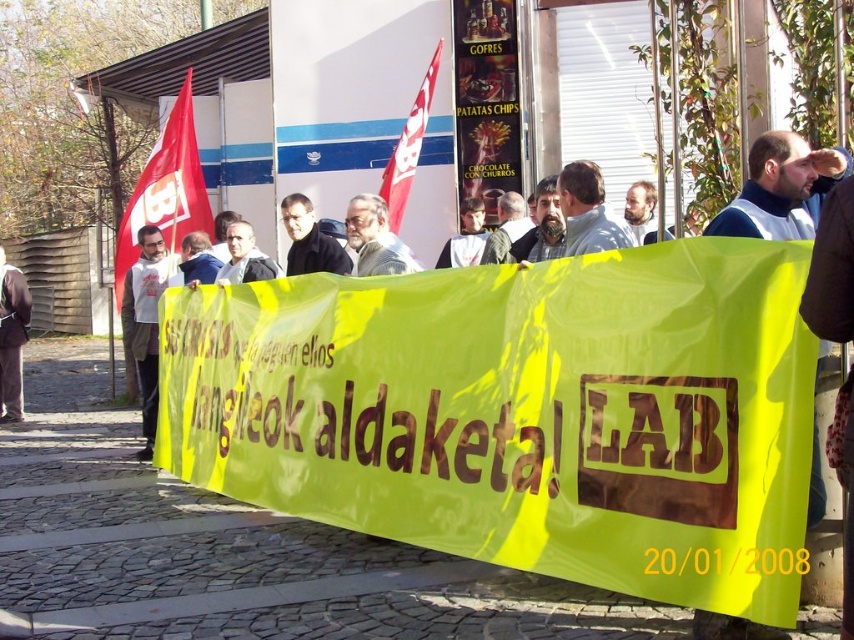
Question: Considering the relative positions of white fleece jacket at left and red fabric flag at upper center in the image provided, where is white fleece jacket at left located with respect to red fabric flag at upper center?

Choices:
 (A) above
 (B) below

Answer: (B)

Question: Is yellow fabric banner at center further to camera compared to red fabric flag at left?

Choices:
 (A) no
 (B) yes

Answer: (A)

Question: Estimate the real-world distances between objects in this image. Which object is farther from the brown leather jacket at lower left?

Choices:
 (A) yellow fabric banner at center
 (B) red fabric flag at upper center
 (C) red fabric flag at left

Answer: (A)

Question: Which point appears closest to the camera in this image?

Choices:
 (A) (427, 102)
 (B) (3, 257)
 (C) (148, 164)

Answer: (A)

Question: Which point appears closest to the camera in this image?

Choices:
 (A) (653, 218)
 (B) (135, 228)
 (C) (0, 333)
 (D) (137, 259)

Answer: (A)

Question: Can you confirm if yellow fabric banner at center is positioned above black matte jacket at center?

Choices:
 (A) yes
 (B) no

Answer: (B)